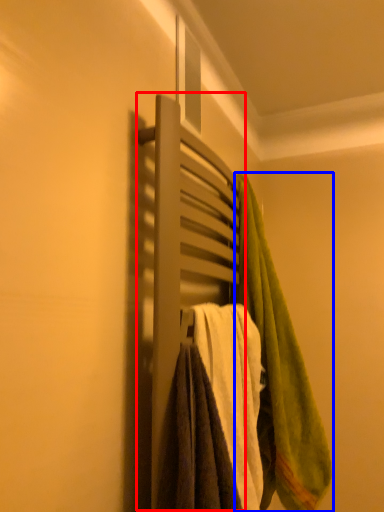
Question: Which of the following is the farthest to the observer, closet (highlighted by a red box) or towel (highlighted by a blue box)?

Choices:
 (A) closet
 (B) towel

Answer: (B)